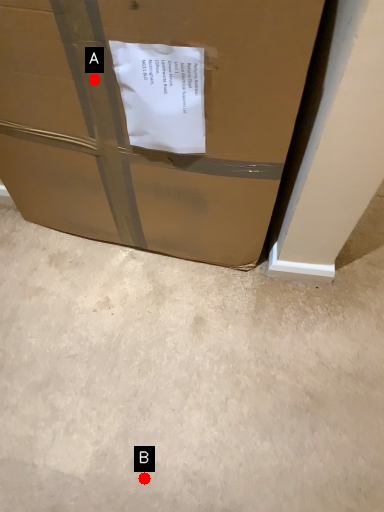
Question: Two points are circled on the image, labeled by A and B beside each circle. Which point appears farthest from the camera in this image?

Choices:
 (A) A is further
 (B) B is further

Answer: (B)